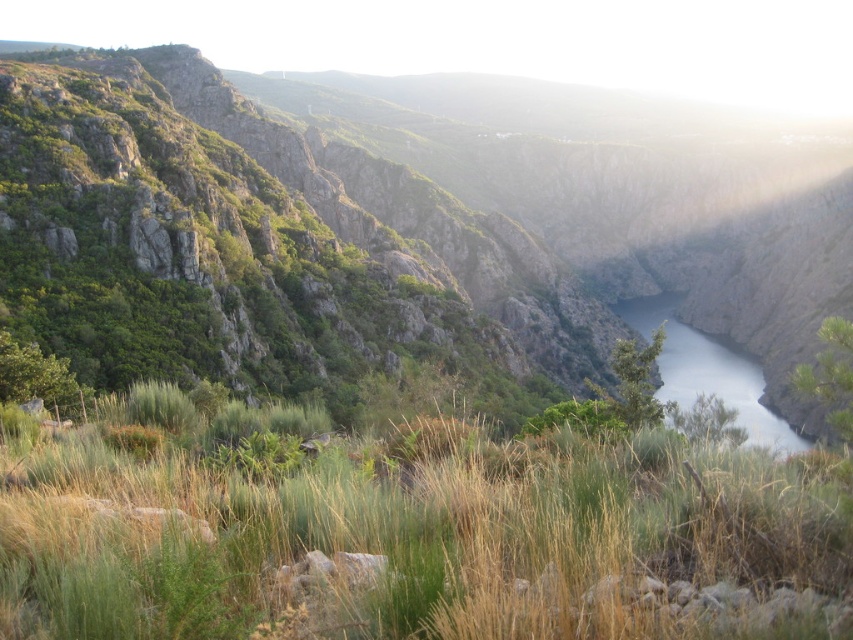
Can you confirm if green grassy at center is shorter than clear water at center?

Correct, green grassy at center is not as tall as clear water at center.

Is green grassy at center to the right of clear water at center from the viewer's perspective?

Incorrect, green grassy at center is not on the right side of clear water at center.

I want to click on green grassy at center, so click(421, 540).

Does green rock at center have a smaller size compared to clear water at center?

No.

Does green rock at center have a lesser width compared to clear water at center?

Incorrect, green rock at center's width is not less than clear water at center's.

What do you see at coordinates (378, 234) in the screenshot? The image size is (853, 640). I see `green rock at center` at bounding box center [378, 234].

In order to click on green rock at center in this screenshot , I will do `click(378, 234)`.

Is green rock at center smaller than green grassy at center?

No.

Which of these two, green rock at center or green grassy at center, stands taller?

Standing taller between the two is green rock at center.

Does point (206, 88) come farther from viewer compared to point (676, 458)?

Yes, it is behind point (676, 458).

Image resolution: width=853 pixels, height=640 pixels. Identify the location of green rock at center. (378, 234).